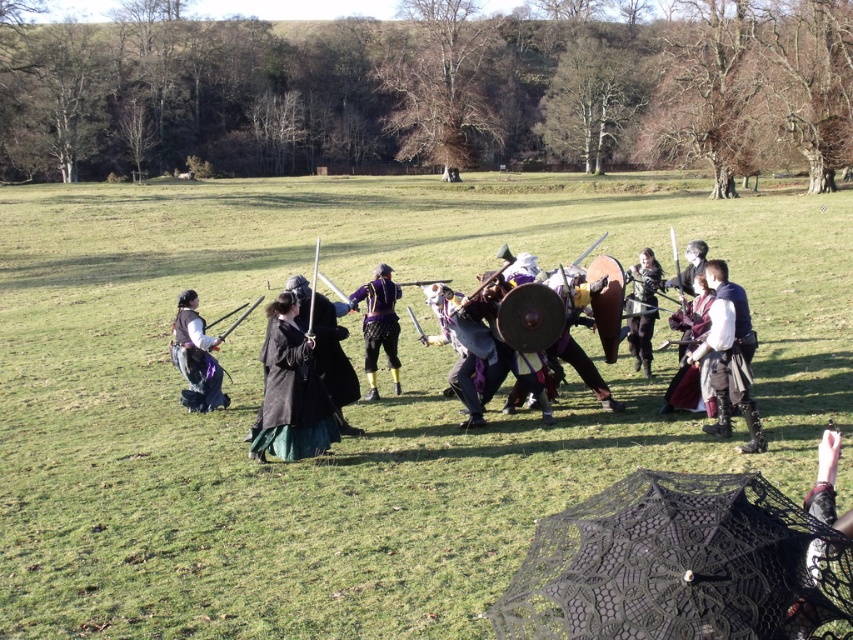
Question: Which point is closer to the camera?

Choices:
 (A) matte leather armor at center
 (B) shiny purple armor at center

Answer: (A)

Question: Can you confirm if dark gray woolen cloak at center is positioned to the left of shiny purple armor at center?

Choices:
 (A) yes
 (B) no

Answer: (A)

Question: Where is black velvet dress at center located in relation to shiny silver armor at center in the image?

Choices:
 (A) below
 (B) above

Answer: (B)

Question: Estimate the real-world distances between objects in this image. Which object is farther from the dark gray woolen cloak at center?

Choices:
 (A) shiny purple armor at center
 (B) matte black vest at left
 (C) matte black umbrella at center

Answer: (C)

Question: Does matte black umbrella at center appear under matte leather armor at center?

Choices:
 (A) yes
 (B) no

Answer: (B)

Question: Among these points, which one is farthest from the camera?

Choices:
 (A) [635, 346]
 (B) [747, 310]
 (C) [196, 410]

Answer: (A)